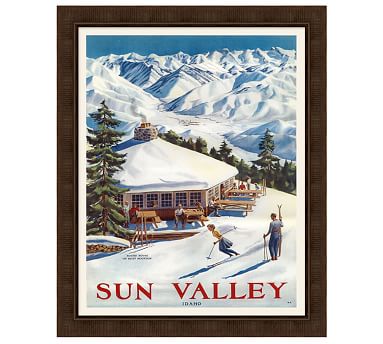
Where is `stone chimney`? This screenshot has width=383, height=344. stone chimney is located at coordinates (146, 130).